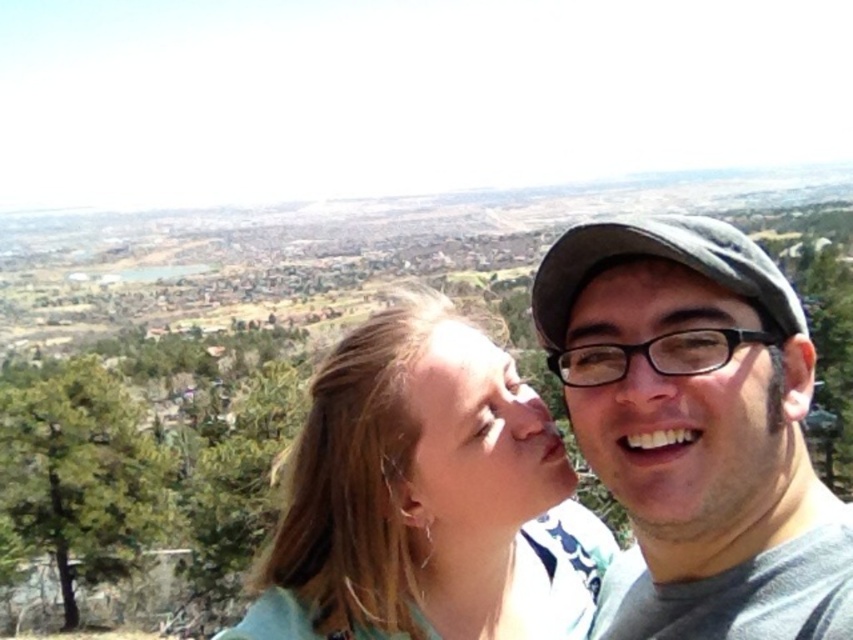
Question: Estimate the real-world distances between objects in this image. Which object is closer to the smooth skin face at center?

Choices:
 (A) blonde hair at center
 (B) gray matte cap at upper right
 (C) matte black glasses at center

Answer: (A)

Question: Considering the relative positions of blonde hair at center and matte black glasses at center in the image provided, where is blonde hair at center located with respect to matte black glasses at center?

Choices:
 (A) right
 (B) left

Answer: (B)

Question: Which object is the farthest from the gray matte cap at upper right?

Choices:
 (A) blonde hair at center
 (B) smooth skin face at center
 (C) matte black glasses at center

Answer: (A)

Question: From the image, what is the correct spatial relationship of gray matte cap at upper right in relation to smooth skin face at center?

Choices:
 (A) left
 (B) right

Answer: (B)

Question: Is blonde hair at center positioned in front of matte black glasses at center?

Choices:
 (A) no
 (B) yes

Answer: (A)

Question: Which object is positioned farthest from the blonde hair at center?

Choices:
 (A) matte black glasses at center
 (B) gray matte cap at upper right

Answer: (A)